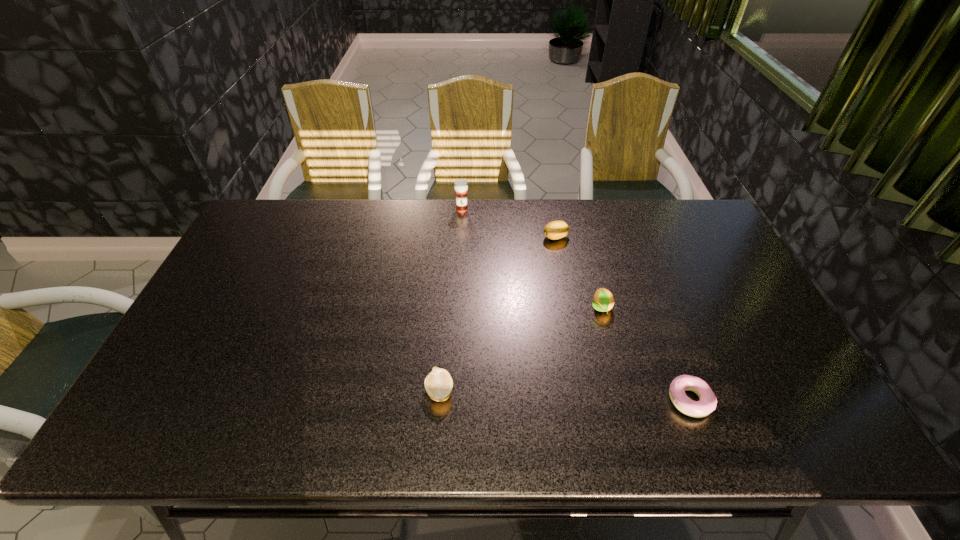
At what (x,y) coordinates should I click in order to perform the action: click on vacant space that is in between the second nearest lemon and the rightmost object. Please return your answer as a coordinate pair (x, y). Looking at the image, I should click on (645, 354).

Identify the location of empty location between the rightmost lemon and the farthest object. This screenshot has height=540, width=960. (531, 259).

At what (x,y) coordinates should I click in order to perform the action: click on free point between the doughnut and the second lemon from right to left. Please return your answer as a coordinate pair (x, y). This screenshot has width=960, height=540. Looking at the image, I should click on (623, 319).

Where is `free spot between the nearest lemon and the rightmost object`? The height and width of the screenshot is (540, 960). free spot between the nearest lemon and the rightmost object is located at coordinates (564, 396).

Select which object appears as the closest to the tallest object. Please provide its 2D coordinates. Your answer should be formatted as a tuple, i.e. [(x, y)], where the tuple contains the x and y coordinates of a point satisfying the conditions above.

[(557, 229)]

Locate an element on the screen. object that is the third nearest to the doughnut is located at coordinates (557, 229).

Locate an element on the screen. lemon that is the second closest to the nearest lemon is located at coordinates (557, 229).

Locate an element on the screen. the closest lemon relative to the third nearest object is located at coordinates (557, 229).

Locate an element on the screen. vacant region that satisfies the following two spatial constraints: 1. on the label side of the medicine; 2. on the right side of the rightmost object is located at coordinates (452, 400).